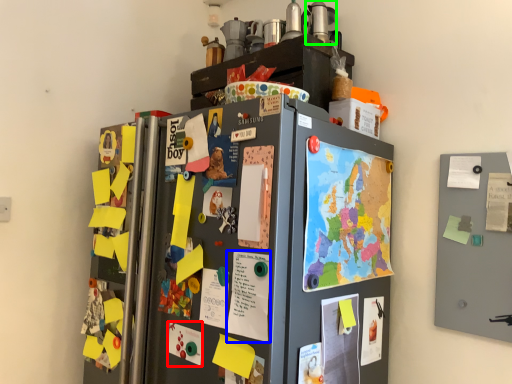
Question: Which object is positioned closest to poster (highlighted by a red box)? Select from poster (highlighted by a blue box) and appliance (highlighted by a green box).

Choices:
 (A) poster
 (B) appliance

Answer: (A)